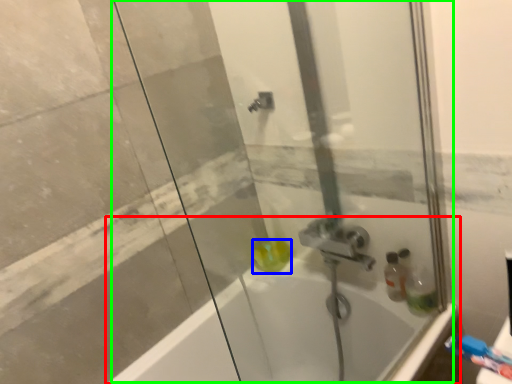
Question: Based on their relative distances, which object is nearer to bathtub (highlighted by a red box)? Choose from liquid (highlighted by a blue box) and shower door (highlighted by a green box).

Choices:
 (A) liquid
 (B) shower door

Answer: (A)